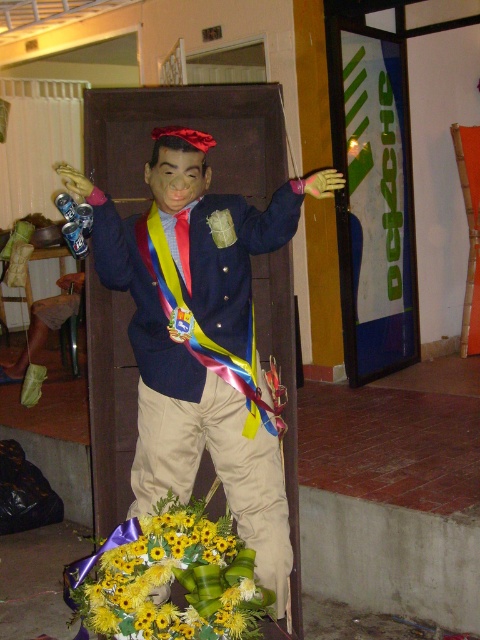
Does matte plastic boy at center appear on the left side of yellow artificial flowers at lower center?

In fact, matte plastic boy at center is to the right of yellow artificial flowers at lower center.

Who is shorter, matte plastic boy at center or yellow artificial flowers at lower center?

yellow artificial flowers at lower center

Who is more distant from viewer, (x=135, y=358) or (x=199, y=612)?

Point (x=135, y=358)

Locate an element on the screen. The width and height of the screenshot is (480, 640). matte plastic boy at center is located at coordinates (202, 337).